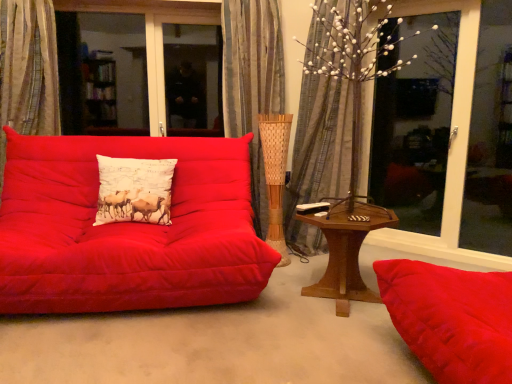
Question: Would you say matte red studio couch at left is a long distance from textured beige curtain at left, the third curtain when ordered from right to left?

Choices:
 (A) yes
 (B) no

Answer: (B)

Question: Does matte red studio couch at left appear on the left side of textured beige curtain at left, the third curtain when ordered from right to left?

Choices:
 (A) yes
 (B) no

Answer: (B)

Question: Is matte red studio couch at left outside textured beige curtain at left, the third curtain when ordered from right to left?

Choices:
 (A) yes
 (B) no

Answer: (A)

Question: Is matte red studio couch at left closer to camera compared to textured beige curtain at left, arranged as the first curtain when viewed from the left?

Choices:
 (A) no
 (B) yes

Answer: (B)

Question: Considering the relative sizes of matte red studio couch at left and textured beige curtain at left, the third curtain when ordered from right to left, in the image provided, is matte red studio couch at left shorter than textured beige curtain at left, the third curtain when ordered from right to left,?

Choices:
 (A) no
 (B) yes

Answer: (B)

Question: Is matte red studio couch at left taller than textured beige curtain at left, arranged as the first curtain when viewed from the left?

Choices:
 (A) no
 (B) yes

Answer: (A)

Question: Is wooden hexagonal table at center at the left side of white printed cushion at center?

Choices:
 (A) no
 (B) yes

Answer: (A)

Question: Could you tell me if wooden hexagonal table at center is facing white printed cushion at center?

Choices:
 (A) yes
 (B) no

Answer: (B)

Question: Considering the relative sizes of wooden hexagonal table at center and white printed cushion at center in the image provided, is wooden hexagonal table at center bigger than white printed cushion at center?

Choices:
 (A) yes
 (B) no

Answer: (A)

Question: Would you say wooden hexagonal table at center is outside white printed cushion at center?

Choices:
 (A) yes
 (B) no

Answer: (A)

Question: Is wooden hexagonal table at center positioned behind white printed cushion at center?

Choices:
 (A) no
 (B) yes

Answer: (A)

Question: Is wooden hexagonal table at center oriented away from white printed cushion at center?

Choices:
 (A) yes
 (B) no

Answer: (B)

Question: Does silky gray curtain at center, the 3th curtain in the left-to-right sequence, have a larger size compared to white printed cushion at center?

Choices:
 (A) no
 (B) yes

Answer: (B)